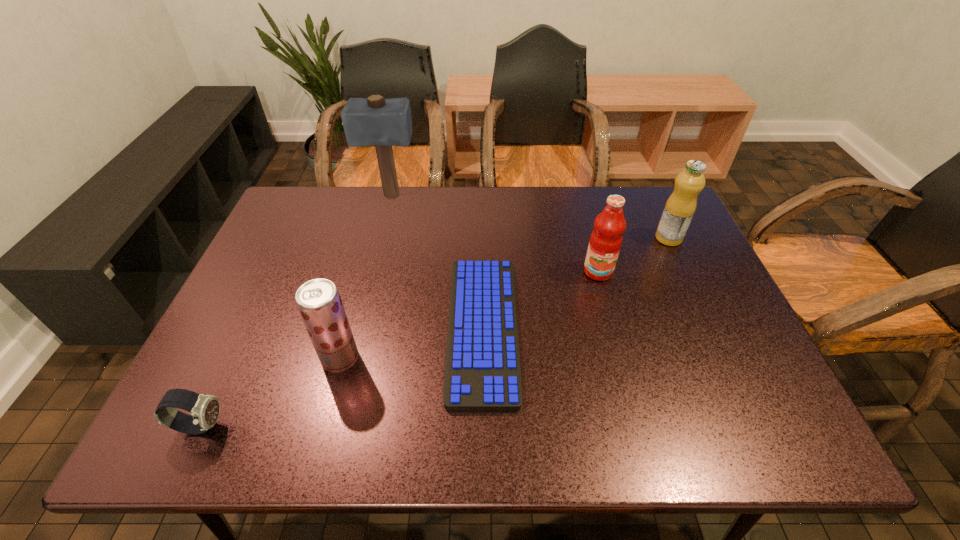
You are a GUI agent. You are given a task and a screenshot of the screen. Output one action in this format:
    pyautogui.click(x=<x>, y=<y>)
    Task: Click on the fruit juice that is at the far edge
    The image size is (960, 540).
    Given the screenshot: What is the action you would take?
    pyautogui.click(x=680, y=207)

Find the location of a particular element. watch that is positioned at the near edge is located at coordinates (205, 409).

Where is `computer keyboard located in the near edge section of the desktop`? The width and height of the screenshot is (960, 540). computer keyboard located in the near edge section of the desktop is located at coordinates (482, 370).

Where is `object present at the left edge`? object present at the left edge is located at coordinates (205, 409).

What are the coordinates of `object present at the right edge` in the screenshot? It's located at (680, 207).

Locate an element on the screen. Image resolution: width=960 pixels, height=540 pixels. object that is at the near left corner is located at coordinates (205, 409).

Image resolution: width=960 pixels, height=540 pixels. What are the coordinates of `object that is positioned at the far right corner` in the screenshot? It's located at (680, 207).

The image size is (960, 540). Find the location of `vacant space at the far edge of the desktop`. vacant space at the far edge of the desktop is located at coordinates (354, 191).

Locate an element on the screen. The width and height of the screenshot is (960, 540). vacant space at the near edge is located at coordinates (701, 442).

The width and height of the screenshot is (960, 540). I want to click on free space at the left edge, so click(247, 325).